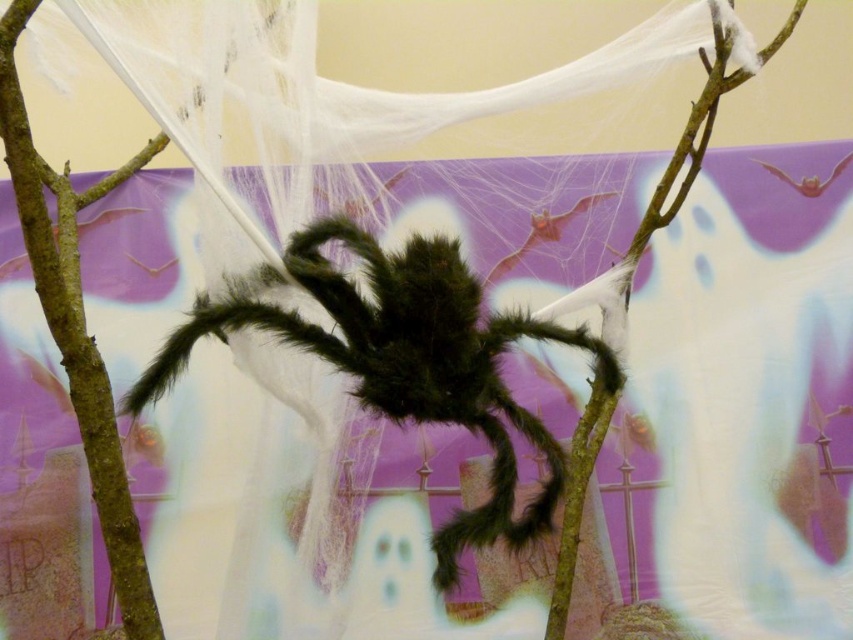
Question: Is fuzzy black spider at center bigger than brown rough tree branch at center?

Choices:
 (A) yes
 (B) no

Answer: (A)

Question: Which of the following is the closest to the observer?

Choices:
 (A) fuzzy black spider at center
 (B) brown rough tree branch at center

Answer: (B)

Question: Can you confirm if fuzzy black spider at center is thinner than brown rough tree branch at center?

Choices:
 (A) no
 (B) yes

Answer: (A)

Question: From the image, what is the correct spatial relationship of fuzzy black spider at center in relation to brown rough tree branch at center?

Choices:
 (A) left
 (B) right

Answer: (B)